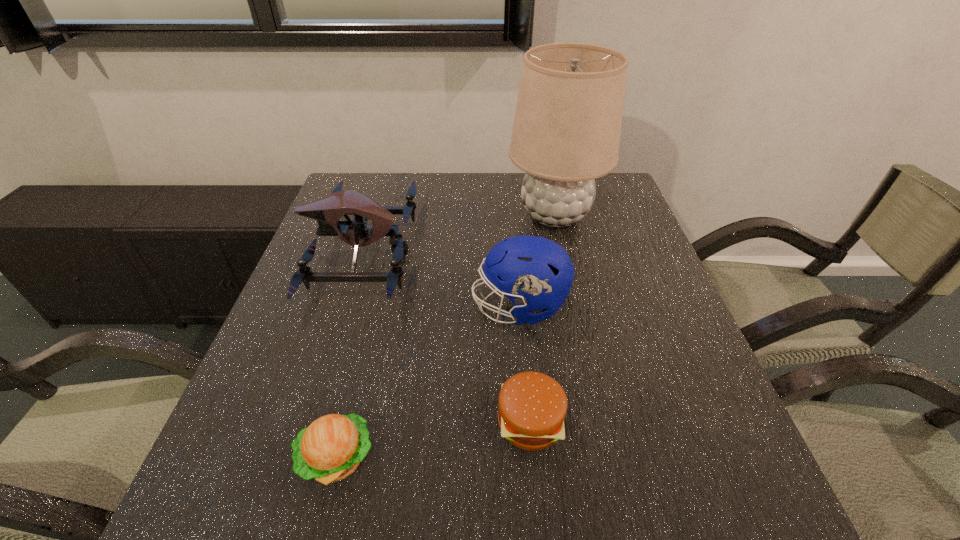
Where is `free space between the football helmet and the left hamburger`? free space between the football helmet and the left hamburger is located at coordinates (428, 383).

Where is `vacant space in between the drone and the lampshade`? This screenshot has height=540, width=960. vacant space in between the drone and the lampshade is located at coordinates (458, 234).

What are the coordinates of `free space between the right hamburger and the football helmet` in the screenshot? It's located at (525, 364).

I want to click on object that is the closest one to the right hamburger, so click(x=535, y=273).

Where is `the third closest object to the lampshade`? the third closest object to the lampshade is located at coordinates (532, 406).

Where is `free space in the image that satisfies the following two spatial constraints: 1. on the front-facing side of the right hamburger; 2. on the right side of the drone`? free space in the image that satisfies the following two spatial constraints: 1. on the front-facing side of the right hamburger; 2. on the right side of the drone is located at coordinates (307, 422).

Locate an element on the screen. free space that satisfies the following two spatial constraints: 1. on the front side of the tallest object; 2. on the front-facing side of the football helmet is located at coordinates (575, 307).

Locate an element on the screen. The width and height of the screenshot is (960, 540). vacant area in the image that satisfies the following two spatial constraints: 1. on the back side of the left hamburger; 2. on the left side of the tallest object is located at coordinates (397, 215).

Locate an element on the screen. Image resolution: width=960 pixels, height=540 pixels. free space that satisfies the following two spatial constraints: 1. on the front-facing side of the football helmet; 2. on the front side of the left hamburger is located at coordinates (533, 458).